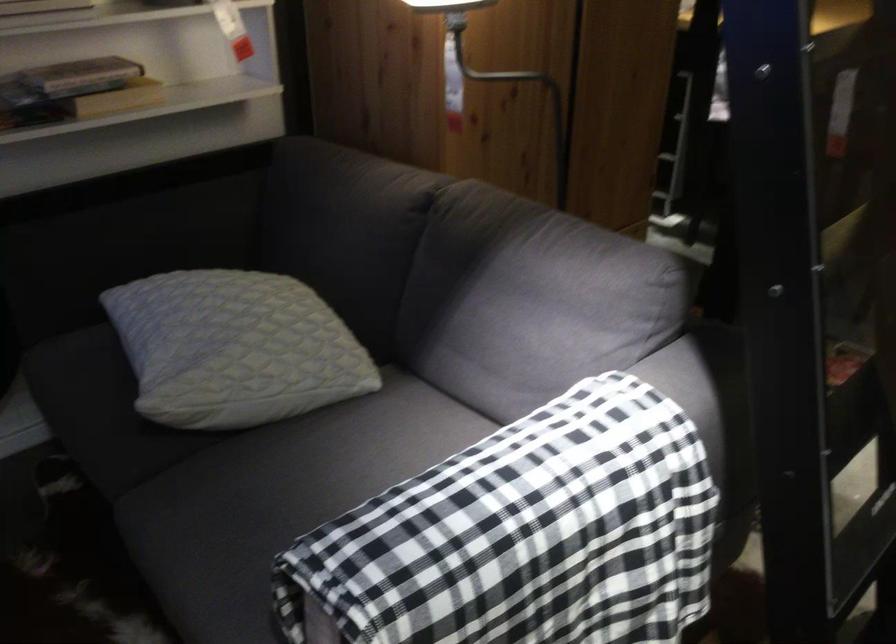
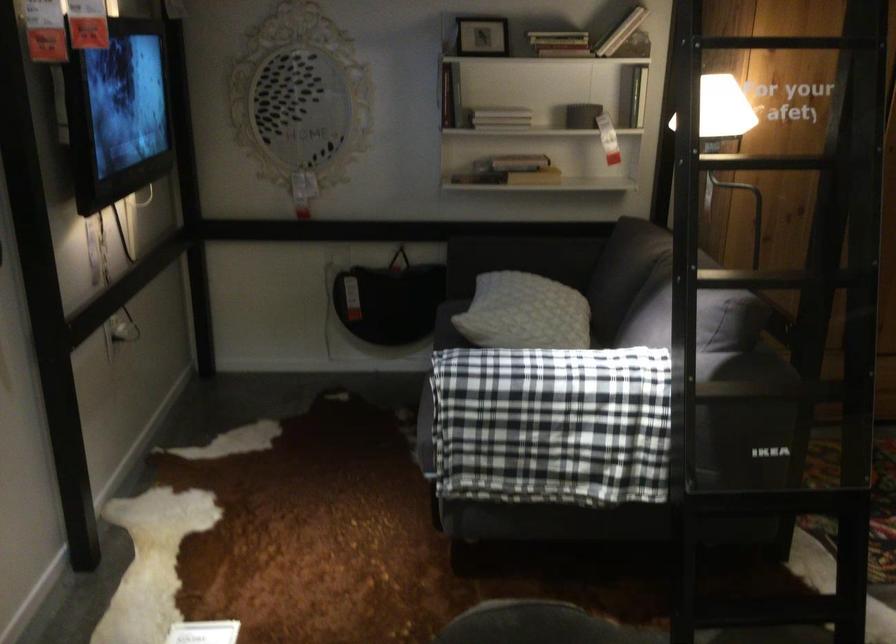
In the second image, find the point that corresponds to the point at 260,357 in the first image.

(524, 313)